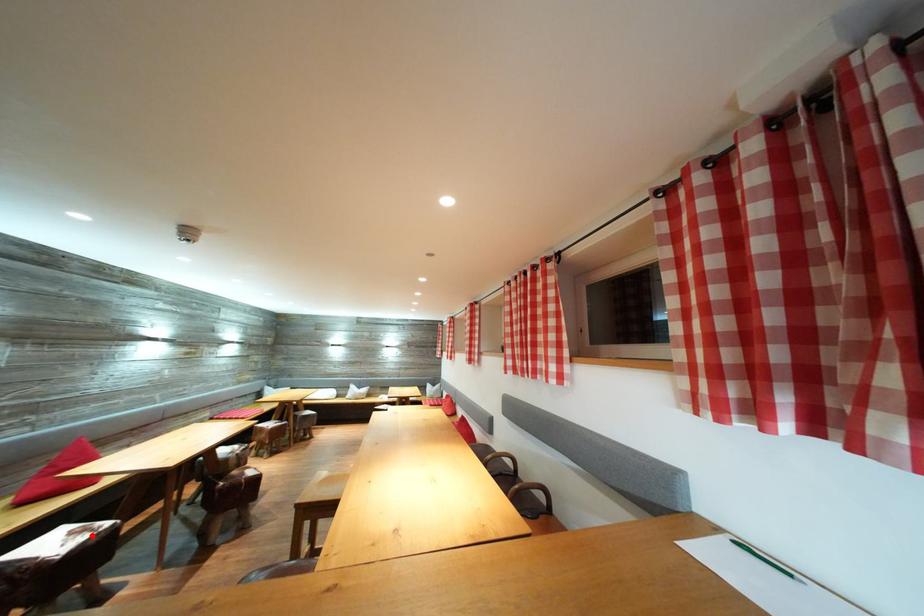
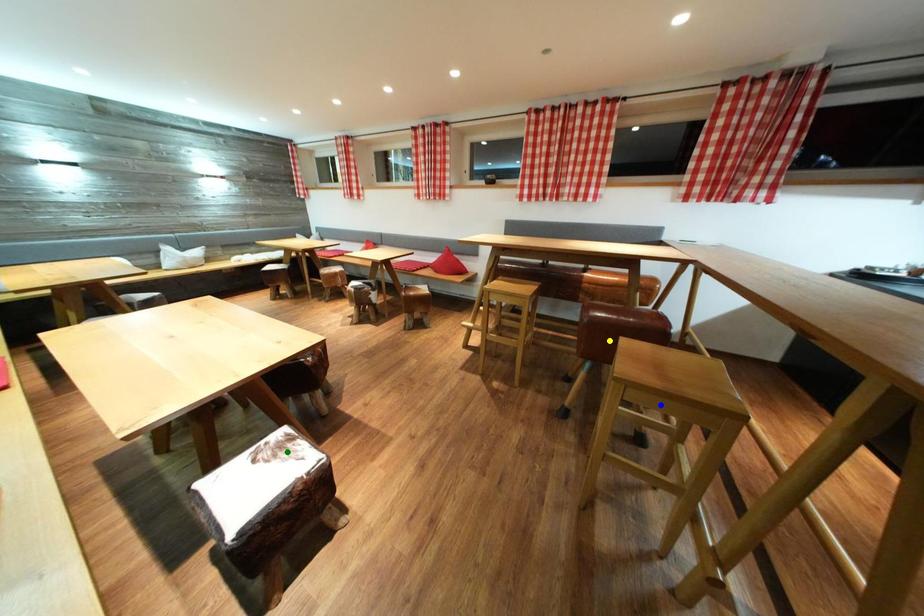
Question: I am providing you with two images of the same scene from different viewpoints. A red point is marked on the first image. You are given multiple points on the second image. Which point in image 2 is actually the same real-world point as the red point in image 1?

Choices:
 (A) green point
 (B) blue point
 (C) yellow point

Answer: (A)